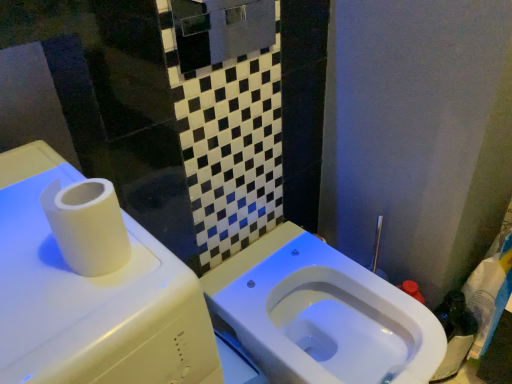
The image size is (512, 384). Describe the element at coordinates (91, 297) in the screenshot. I see `white matte water tank at upper left` at that location.

I want to click on white matte water tank at upper left, so click(91, 297).

This screenshot has width=512, height=384. Describe the element at coordinates (321, 314) in the screenshot. I see `white glossy toilet at center` at that location.

What is the approximate width of white glossy toilet at center?

21.45 inches.

Find the location of `white glossy toilet at center`. white glossy toilet at center is located at coordinates (321, 314).

Locate an element on the screen. This screenshot has width=512, height=384. white matte water tank at upper left is located at coordinates (91, 297).

Does white matte water tank at upper left appear on the left side of white glossy toilet at center?

Indeed, white matte water tank at upper left is positioned on the left side of white glossy toilet at center.

Is white matte water tank at upper left in front of or behind white glossy toilet at center in the image?

white matte water tank at upper left is in front of white glossy toilet at center.

Between point (116, 340) and point (301, 314), which one is positioned in front?

Positioned in front is point (116, 340).

From the picture: From the image's perspective, which is above, white matte water tank at upper left or white glossy toilet at center?

white matte water tank at upper left, from the image's perspective.

From a real-world perspective, which object rests below the other?

white glossy toilet at center is physically lower.

Does white matte water tank at upper left have a lesser width compared to white glossy toilet at center?

No, white matte water tank at upper left is not thinner than white glossy toilet at center.

Can you confirm if white matte water tank at upper left is shorter than white glossy toilet at center?

No.

Who is smaller, white matte water tank at upper left or white glossy toilet at center?

white glossy toilet at center.

Is white matte water tank at upper left situated inside white glossy toilet at center or outside?

white matte water tank at upper left is not inside white glossy toilet at center, it's outside.

Is white matte water tank at upper left next to white glossy toilet at center and touching it?

white matte water tank at upper left and white glossy toilet at center are not in contact.

Is white matte water tank at upper left positioned with its back to white glossy toilet at center?

No, white matte water tank at upper left is not facing away from white glossy toilet at center.

How different are the orientations of white matte water tank at upper left and white glossy toilet at center in degrees?

The angle between the facing direction of white matte water tank at upper left and the facing direction of white glossy toilet at center is 0.0875 degrees.

How much distance is there between white matte water tank at upper left and white glossy toilet at center?

white matte water tank at upper left and white glossy toilet at center are 54.92 centimeters apart.

You are a GUI agent. You are given a task and a screenshot of the screen. Output one action in this format:
    pyautogui.click(x=<x>, y=<y>)
    Task: Click on the water tank lying above the white glossy toilet at center (from the image's perspective)
    This screenshot has height=384, width=512.
    Given the screenshot: What is the action you would take?
    pyautogui.click(x=91, y=297)

Is white glossy toilet at center at the left side of white matte water tank at upper left?

No.

Is the position of white glossy toilet at center more distant than that of white matte water tank at upper left?

Yes, it is behind white matte water tank at upper left.

Which is less distant, (428,319) or (12,316)?

The point (12,316) is in front.

From the image's perspective, who appears lower, white glossy toilet at center or white matte water tank at upper left?

white glossy toilet at center appears lower in the image.

From a real-world perspective, which is physically above, white glossy toilet at center or white matte water tank at upper left?

white matte water tank at upper left is physically above.

Looking at this image, is white glossy toilet at center thinner than white matte water tank at upper left?

Correct, the width of white glossy toilet at center is less than that of white matte water tank at upper left.

Which of these two, white glossy toilet at center or white matte water tank at upper left, stands shorter?

white glossy toilet at center is shorter.

In the scene shown: Is white glossy toilet at center bigger or smaller than white matte water tank at upper left?

Considering their sizes, white glossy toilet at center takes up less space than white matte water tank at upper left.

Is white glossy toilet at center positioned beyond the bounds of white matte water tank at upper left?

white glossy toilet at center lies outside white matte water tank at upper left's area.

Are white glossy toilet at center and white matte water tank at upper left far apart?

Actually, white glossy toilet at center and white matte water tank at upper left are a little close together.

Is white glossy toilet at center aimed at white matte water tank at upper left?

No, white glossy toilet at center is not aimed at white matte water tank at upper left.

What's the angular difference between white glossy toilet at center and white matte water tank at upper left's facing directions?

They differ by 0.0875 degrees in their facing directions.

Identify the location of toilet below the white matte water tank at upper left (from a real-world perspective). (321, 314).

Find the location of a particular element. toilet behind the white matte water tank at upper left is located at coordinates (321, 314).

Where is `water tank to the left of white glossy toilet at center`? water tank to the left of white glossy toilet at center is located at coordinates (91, 297).